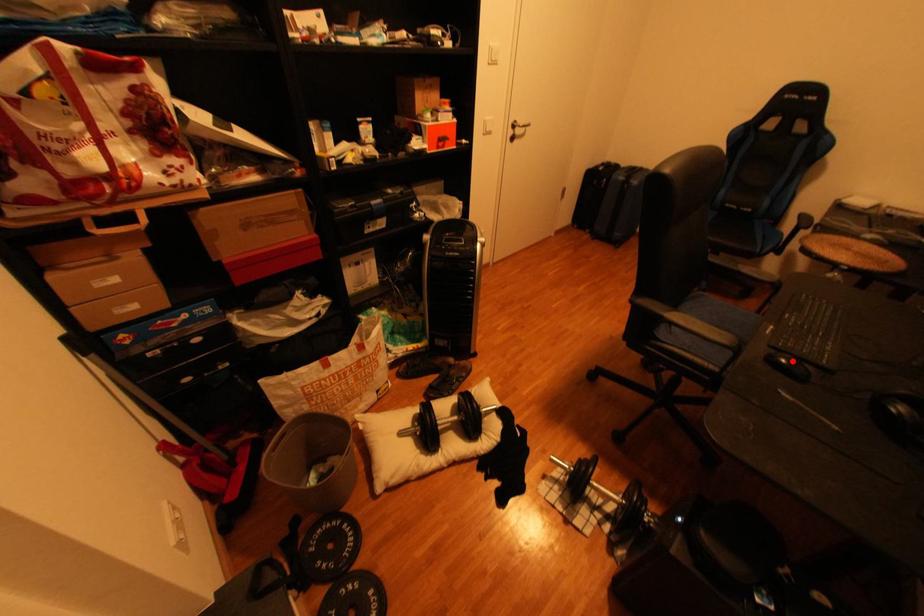
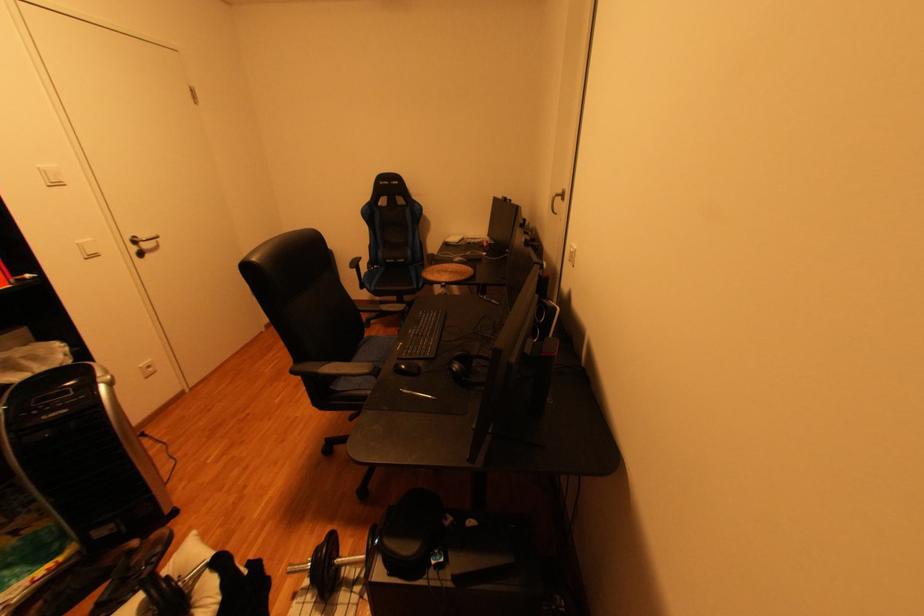
Find the pixel in the second image that matches the highlighted location in the first image.

(411, 367)